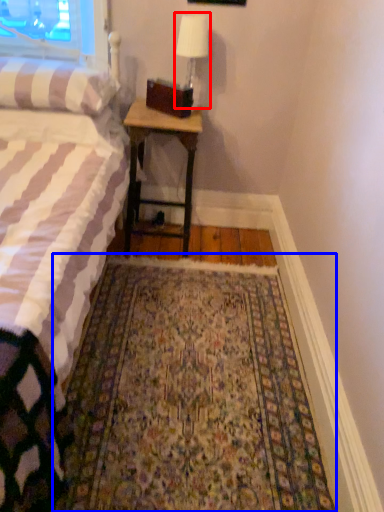
Question: Which point is further to the camera, bedside lamp (highlighted by a red box) or mat (highlighted by a blue box)?

Choices:
 (A) bedside lamp
 (B) mat

Answer: (A)